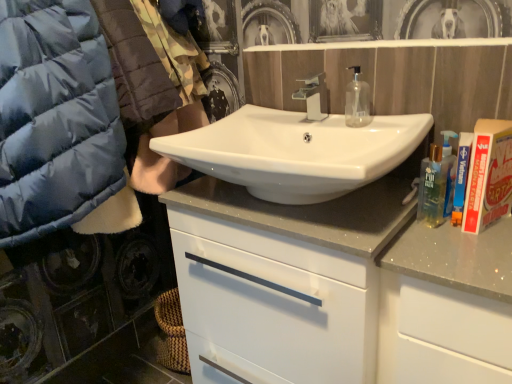
This screenshot has width=512, height=384. What are the coordinates of `vacant space in white glossy sink at center (from a real-world perspective)` in the screenshot? It's located at (290, 206).